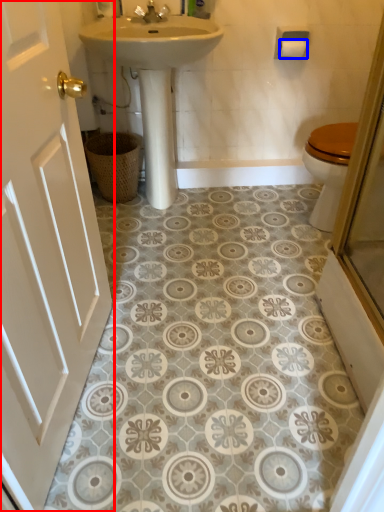
Question: Which point is further to the camera, door (highlighted by a red box) or toilet paper (highlighted by a blue box)?

Choices:
 (A) door
 (B) toilet paper

Answer: (B)